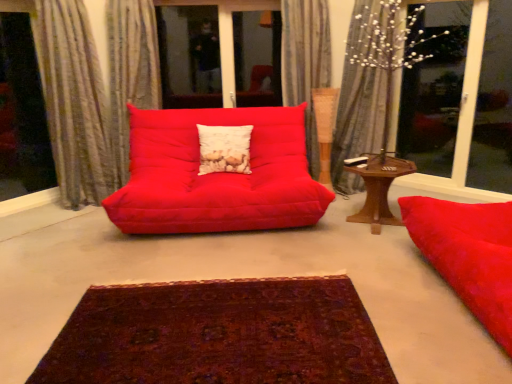
Identify the location of vacant area on the back side of deep burgundy woven rug at center. (220, 251).